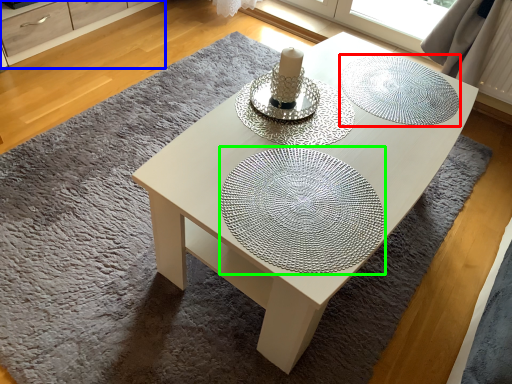
Question: Considering the real-world distances, which object is closest to glass plate (highlighted by a red box)? dresser (highlighted by a blue box) or glass plate (highlighted by a green box).

Choices:
 (A) dresser
 (B) glass plate

Answer: (B)